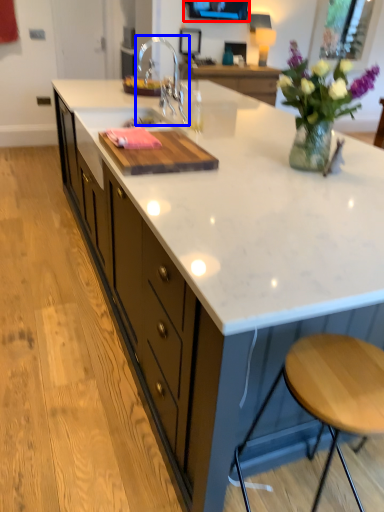
Question: Which of the following is the farthest to the observer, window screen (highlighted by a red box) or tap (highlighted by a blue box)?

Choices:
 (A) window screen
 (B) tap

Answer: (A)